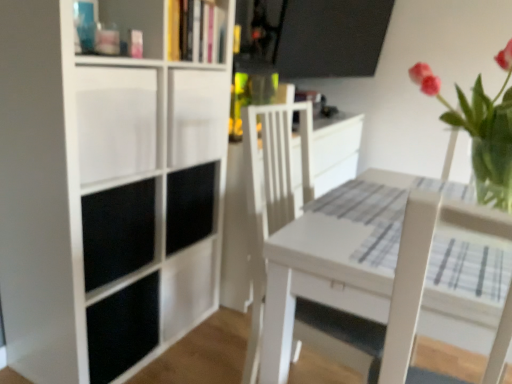
Describe the element at coordinates (196, 31) in the screenshot. I see `hardcover book at upper center` at that location.

In order to click on white wood swivel chair at center in this screenshot , I will do `click(271, 195)`.

Who is smaller, white matte bookcase at left or white matte cabinet at left, which ranks as the 1th cabinet in front-to-back order?

With smaller size is white matte cabinet at left, which ranks as the 1th cabinet in front-to-back order.

Between white matte bookcase at left and white matte cabinet at left, which ranks as the 1th cabinet in front-to-back order, which one appears on the right side from the viewer's perspective?

white matte bookcase at left is more to the right.

From the picture: Would you say white matte bookcase at left is inside or outside white matte cabinet at left, the second cabinet when ordered from back to front?

white matte bookcase at left is spatially situated outside white matte cabinet at left, the second cabinet when ordered from back to front.

Is white matte bookcase at left facing away from white matte cabinet at left, which ranks as the 1th cabinet in front-to-back order?

Yes, white matte bookcase at left is positioned with its back facing white matte cabinet at left, which ranks as the 1th cabinet in front-to-back order.

Is hardcover book at upper center at the back of black matte cabinet at center, the 1th cabinet from the back?

That's not correct — black matte cabinet at center, the 1th cabinet from the back, is not looking away from hardcover book at upper center.

Between black matte cabinet at center, the 1th cabinet from the back, and hardcover book at upper center, which one has larger width?

black matte cabinet at center, the 1th cabinet from the back.

From a real-world perspective, relative to hardcover book at upper center, is black matte cabinet at center, the 1th cabinet from the back, vertically above or below?

black matte cabinet at center, the 1th cabinet from the back, is below hardcover book at upper center.

Is hardcover book at upper center spatially inside pink glass vase at upper right, or outside of it?

hardcover book at upper center exists outside the volume of pink glass vase at upper right.

From the image's perspective, is hardcover book at upper center located above pink glass vase at upper right?

Correct, hardcover book at upper center appears higher than pink glass vase at upper right in the image.

Is point (192, 25) positioned in front of point (467, 131)?

That is False.

Is hardcover book at upper center not close to pink glass vase at upper right?

hardcover book at upper center is actually quite close to pink glass vase at upper right.

Is pink glass vase at upper right with white wood table at center?

pink glass vase at upper right and white wood table at center are not in contact.

Could you tell me if pink glass vase at upper right is turned towards white wood table at center?

No, pink glass vase at upper right does not turn towards white wood table at center.

What are the coordinates of `table in front of the pink glass vase at upper right` in the screenshot? It's located at (379, 282).

From the image's perspective, is pink glass vase at upper right on white wood table at center?

Yes, from the image's perspective, pink glass vase at upper right is on top of white wood table at center.

From a real-world perspective, between white matte cabinet at left, which ranks as the 1th cabinet in front-to-back order, and black matte cabinet at center, the 1th cabinet from the back, who is vertically higher?

white matte cabinet at left, which ranks as the 1th cabinet in front-to-back order, from a real-world perspective.

Choose the correct answer: Is white matte cabinet at left, the second cabinet when ordered from back to front, inside black matte cabinet at center, the 1th cabinet from the back, or outside it?

white matte cabinet at left, the second cabinet when ordered from back to front, is outside black matte cabinet at center, the 1th cabinet from the back.

Is white matte cabinet at left, which ranks as the 1th cabinet in front-to-back order, turned away from black matte cabinet at center, the 1th cabinet from the back?

No.

Considering the sizes of white matte cabinet at left, the second cabinet when ordered from back to front, and black matte cabinet at center, which is the 2th cabinet from front to back, in the image, is white matte cabinet at left, the second cabinet when ordered from back to front, taller or shorter than black matte cabinet at center, which is the 2th cabinet from front to back,?

white matte cabinet at left, the second cabinet when ordered from back to front, is taller than black matte cabinet at center, which is the 2th cabinet from front to back.

Can you confirm if white matte bookcase at left is taller than hardcover book at upper center?

Indeed, white matte bookcase at left has a greater height compared to hardcover book at upper center.

Based on their sizes in the image, would you say white matte bookcase at left is bigger or smaller than hardcover book at upper center?

Clearly, white matte bookcase at left is larger in size than hardcover book at upper center.

This screenshot has width=512, height=384. I want to click on bookcase in front of the hardcover book at upper center, so click(106, 190).

From the image's perspective, would you say white matte bookcase at left is shown under hardcover book at upper center?

Indeed, from the image's perspective, white matte bookcase at left is shown beneath hardcover book at upper center.

Could you tell me if white wood swivel chair at center is turned towards white matte bookcase at left?

No, white wood swivel chair at center does not turn towards white matte bookcase at left.

The image size is (512, 384). In order to click on bookcase above the white wood swivel chair at center (from a real-world perspective) in this screenshot , I will do `click(106, 190)`.

Would you say white wood swivel chair at center is outside white matte bookcase at left?

That's correct, white wood swivel chair at center is outside of white matte bookcase at left.

What's the angular difference between white wood swivel chair at center and white matte bookcase at left's facing directions?

white wood swivel chair at center and white matte bookcase at left are facing 6.28 degrees away from each other.

The height and width of the screenshot is (384, 512). What are the coordinates of `the 1st cabinet behind when counting from the white matte bookcase at left` in the screenshot? It's located at (116, 122).

Which cabinet is the 1st one when counting from the left side of the hardcover book at upper center? Please provide its 2D coordinates.

[(190, 205)]

Considering their positions, is white matte cabinet at left, which ranks as the 1th cabinet in front-to-back order, positioned closer to white wood table at center than hardcover book at upper center?

white matte cabinet at left, which ranks as the 1th cabinet in front-to-back order, lies closer to white wood table at center than the other object.

Considering their positions, is black matte cabinet at center, which is the 2th cabinet from front to back, positioned closer to white matte bookcase at left than white wood swivel chair at center?

black matte cabinet at center, which is the 2th cabinet from front to back, is closer to white matte bookcase at left.

Based on the photo, which object lies nearer to the anchor point white wood swivel chair at center, black matte cabinet at center, the 1th cabinet from the back, or white matte bookcase at left?

black matte cabinet at center, the 1th cabinet from the back, is positioned closer to the anchor white wood swivel chair at center.

Consider the image. From the image, which object appears to be nearer to white matte cabinet at left, which ranks as the 1th cabinet in front-to-back order, white wood swivel chair at center or white matte bookcase at left?

white matte bookcase at left is positioned closer to the anchor white matte cabinet at left, which ranks as the 1th cabinet in front-to-back order.

When comparing their distances from black matte cabinet at center, which is the 2th cabinet from front to back, does white wood swivel chair at center or white wood table at center seem closer?

white wood swivel chair at center is positioned closer to the anchor black matte cabinet at center, which is the 2th cabinet from front to back.

From the image, which object appears to be farther from white matte cabinet at left, which ranks as the 1th cabinet in front-to-back order, white matte bookcase at left or pink glass vase at upper right?

pink glass vase at upper right is positioned further to the anchor white matte cabinet at left, which ranks as the 1th cabinet in front-to-back order.

Estimate the real-world distances between objects in this image. Which object is closer to white wood table at center, white matte cabinet at left, which ranks as the 1th cabinet in front-to-back order, or white wood swivel chair at center?

white wood swivel chair at center is closer to white wood table at center.

When comparing their distances from black matte cabinet at center, which is the 2th cabinet from front to back, does hardcover book at upper center or white wood table at center seem further?

white wood table at center lies further to black matte cabinet at center, which is the 2th cabinet from front to back, than the other object.

You are a GUI agent. You are given a task and a screenshot of the screen. Output one action in this format:
    pyautogui.click(x=<x>, y=<y>)
    Task: Click on the swivel chair that lies between hardcover book at upper center and white wood table at center from top to bottom
    
    Given the screenshot: What is the action you would take?
    pyautogui.click(x=271, y=195)

Identify the location of book located between black matte cabinet at center, which is the 2th cabinet from front to back, and pink glass vase at upper right in the left-right direction. tap(196, 31).

This screenshot has height=384, width=512. Identify the location of cabinet between white matte bookcase at left and black matte cabinet at center, which is the 2th cabinet from front to back, in the front-back direction. (116, 122).

You are a GUI agent. You are given a task and a screenshot of the screen. Output one action in this format:
    pyautogui.click(x=<x>, y=<y>)
    Task: Click on the bookcase between white matte cabinet at left, which ranks as the 1th cabinet in front-to-back order, and pink glass vase at upper right, in the horizontal direction
    
    Given the screenshot: What is the action you would take?
    pyautogui.click(x=106, y=190)